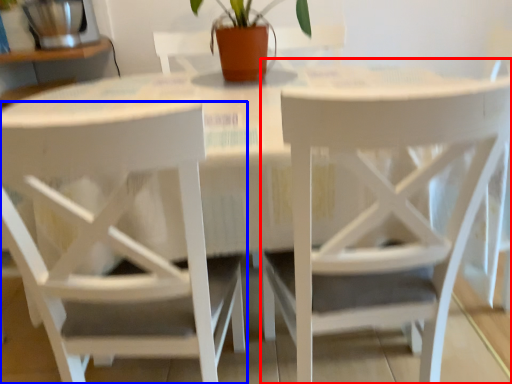
Question: Among these objects, which one is nearest to the camera, chair (highlighted by a red box) or chair (highlighted by a blue box)?

Choices:
 (A) chair
 (B) chair

Answer: (B)